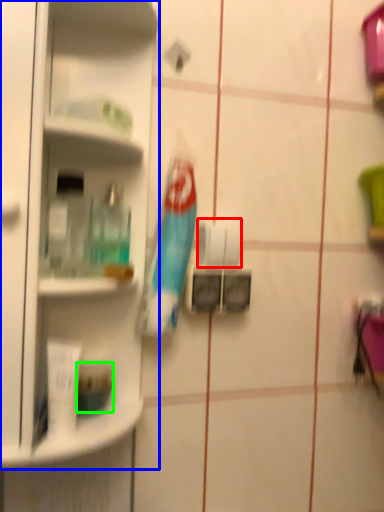
Question: Which object is positioned farthest from toilet paper (highlighted by a red box)? Select from shelf (highlighted by a blue box) and toiletry (highlighted by a green box).

Choices:
 (A) shelf
 (B) toiletry

Answer: (B)